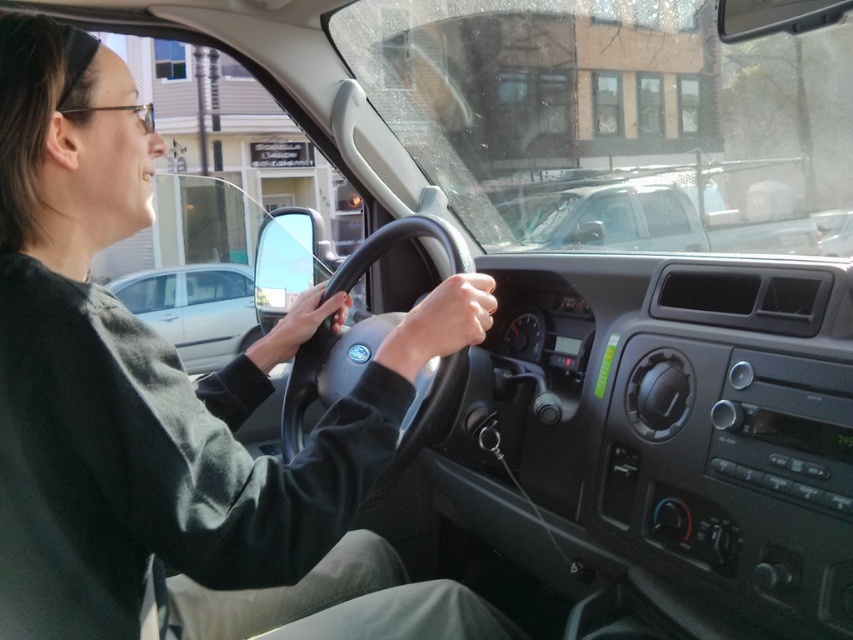
You are sitting in the driver seat of the car and looking through the windshield. There are two points marked on the windshield at coordinates point [328,305] and point [523,205]. Which point is closer to your eyes?

Point [328,305] is closer to the camera than point [523,205].

You are inside a car and want to check the color of the sweater that is at point (177, 410). What color is the sweater?

The dark green sweater at center is located at point (177, 410), so the sweater is dark green.

In the scene shown: You are sitting in the driver seat of the car. You want to check the traffic light ahead but you can only look through the transparent glass windshield at upper center. However, your view is partially blocked by the black rubber steering wheel at center. Which direction should you move your head to see the traffic light clearly?

The transparent glass windshield at upper center is to the right of the black rubber steering wheel at center. To see the traffic light clearly, you should move your head to the right side to avoid the obstruction from the steering wheel.